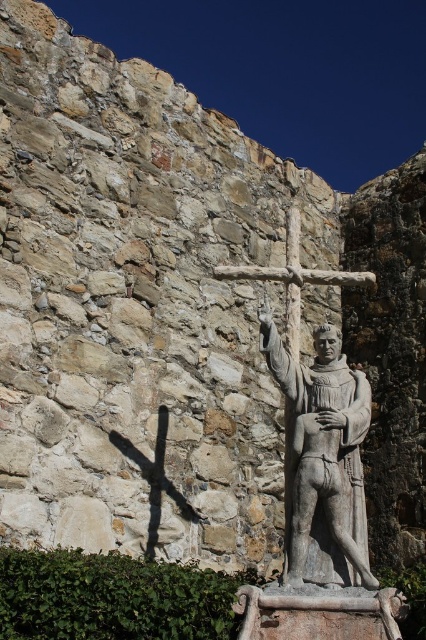
Does gray stone statue at center have a lesser width compared to wooden cross at center?

Yes.

I want to click on gray stone statue at center, so click(x=322, y=460).